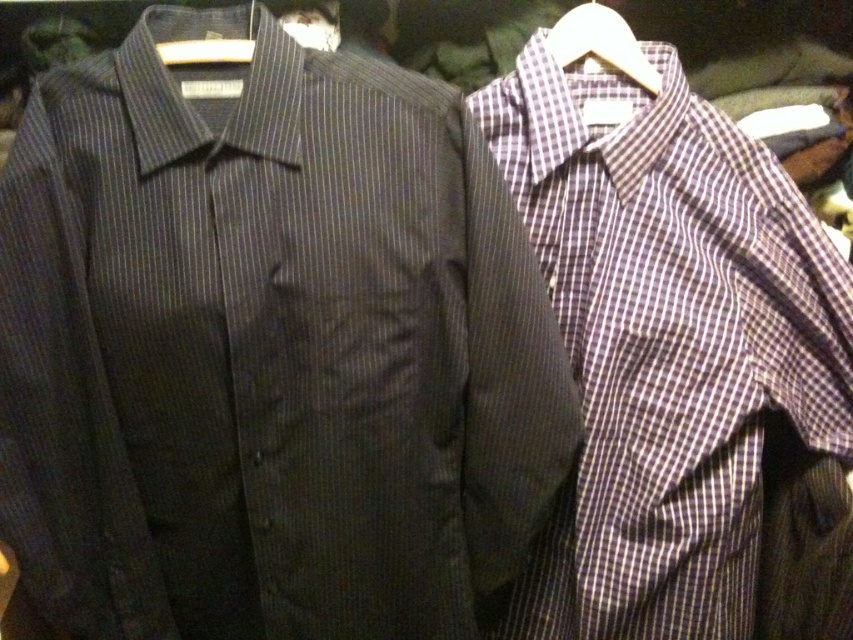
Question: Which object is positioned closest to the white plastic hanger at upper center?

Choices:
 (A) white plastic hanger at upper right
 (B) plaid cotton shirt at right

Answer: (A)

Question: Among these points, which one is nearest to the camera?

Choices:
 (A) (622, 17)
 (B) (802, 253)
 (C) (233, 49)

Answer: (C)

Question: Is plaid cotton shirt at right smaller than white plastic hanger at upper center?

Choices:
 (A) no
 (B) yes

Answer: (A)

Question: Is white plastic hanger at upper right smaller than white plastic hanger at upper center?

Choices:
 (A) no
 (B) yes

Answer: (A)

Question: Among these points, which one is farthest from the camera?

Choices:
 (A) (175, 61)
 (B) (643, 72)

Answer: (B)

Question: Is plaid cotton shirt at right behind white plastic hanger at upper center?

Choices:
 (A) no
 (B) yes

Answer: (B)